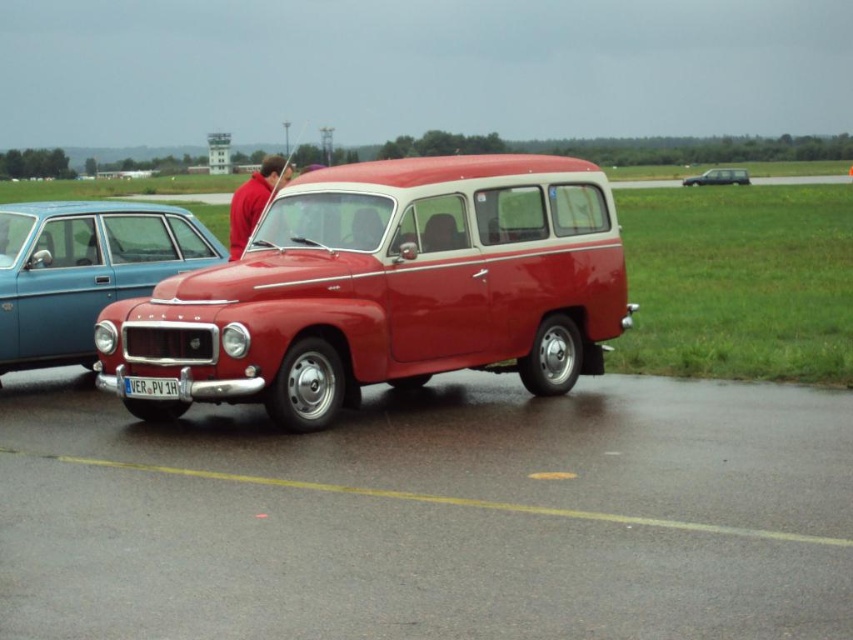
Can you confirm if shiny red station wagon at center is smaller than red smooth shirt at center?

Yes.

From the picture: Which of these two, shiny red station wagon at center or red smooth shirt at center, stands shorter?

Standing shorter between the two is red smooth shirt at center.

At what (x,y) coordinates should I click in order to perform the action: click on shiny red station wagon at center. Please return your answer as a coordinate pair (x, y). The image size is (853, 640). Looking at the image, I should click on (386, 289).

Who is positioned more to the right, white plastic license plate at center or matte silver van at center?

Positioned to the right is matte silver van at center.

The width and height of the screenshot is (853, 640). Describe the element at coordinates (151, 387) in the screenshot. I see `white plastic license plate at center` at that location.

Locate an element on the screen. This screenshot has width=853, height=640. white plastic license plate at center is located at coordinates (151, 387).

Does matte blue sedan at left lie behind white plastic license plate at center?

Yes, it is.

Measure the distance from matte blue sedan at left to white plastic license plate at center.

8.92 feet

Between point (80, 234) and point (154, 387), which one is positioned behind?

Positioned behind is point (80, 234).

Find the location of a particular element. The height and width of the screenshot is (640, 853). matte blue sedan at left is located at coordinates (84, 269).